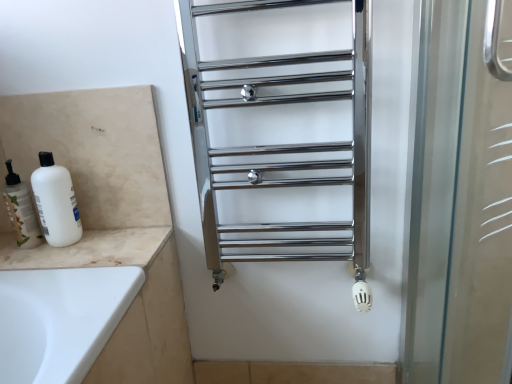
Question: Can you confirm if white matte bottle at left is bigger than white matte bottle at left?

Choices:
 (A) yes
 (B) no

Answer: (A)

Question: Does white matte bottle at left have a greater height compared to white matte bottle at left?

Choices:
 (A) yes
 (B) no

Answer: (A)

Question: From a real-world perspective, is white matte bottle at left physically above white matte bottle at left?

Choices:
 (A) no
 (B) yes

Answer: (B)

Question: Is white matte bottle at left to the right of white matte bottle at left from the viewer's perspective?

Choices:
 (A) no
 (B) yes

Answer: (B)

Question: From the image's perspective, is white matte bottle at left under white matte bottle at left?

Choices:
 (A) yes
 (B) no

Answer: (B)

Question: Considering the relative positions of white matte bottle at left and white matte bottle at left in the image provided, is white matte bottle at left behind white matte bottle at left?

Choices:
 (A) yes
 (B) no

Answer: (B)

Question: From a real-world perspective, is polished chrome towel rack at center beneath beige marble counter top at lower left?

Choices:
 (A) no
 (B) yes

Answer: (A)

Question: Can you confirm if polished chrome towel rack at center is taller than beige marble counter top at lower left?

Choices:
 (A) yes
 (B) no

Answer: (A)

Question: Is polished chrome towel rack at center wider than beige marble counter top at lower left?

Choices:
 (A) no
 (B) yes

Answer: (A)

Question: Is polished chrome towel rack at center to the right of beige marble counter top at lower left from the viewer's perspective?

Choices:
 (A) no
 (B) yes

Answer: (B)

Question: Does polished chrome towel rack at center have a lesser width compared to beige marble counter top at lower left?

Choices:
 (A) no
 (B) yes

Answer: (B)

Question: Is polished chrome towel rack at center located outside beige marble counter top at lower left?

Choices:
 (A) no
 (B) yes

Answer: (B)

Question: Is white matte bottle at left closer to the viewer compared to beige marble counter top at lower left?

Choices:
 (A) no
 (B) yes

Answer: (A)